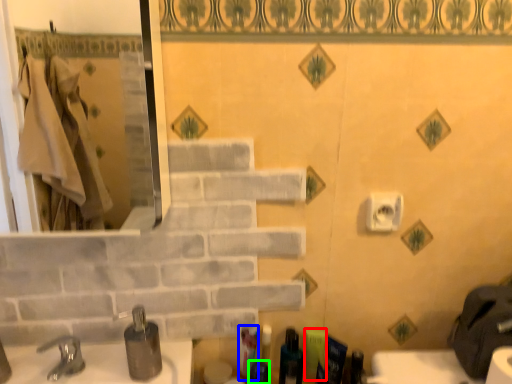
Question: Which object is positioned farthest from toiletry (highlighted by a red box)? Select from toiletry (highlighted by a blue box) and toiletry (highlighted by a green box).

Choices:
 (A) toiletry
 (B) toiletry

Answer: (A)